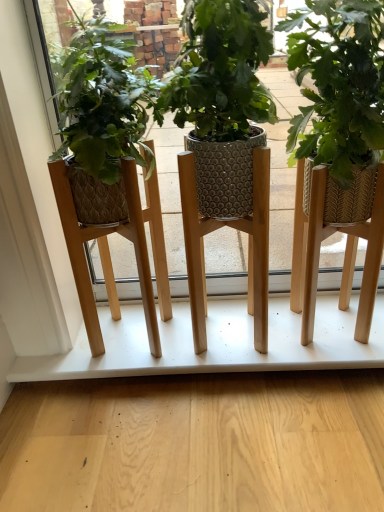
Find the location of a particular element. Image resolution: width=384 pixels, height=512 pixels. free region under green woven basket at center (from a real-world perspective) is located at coordinates (324, 339).